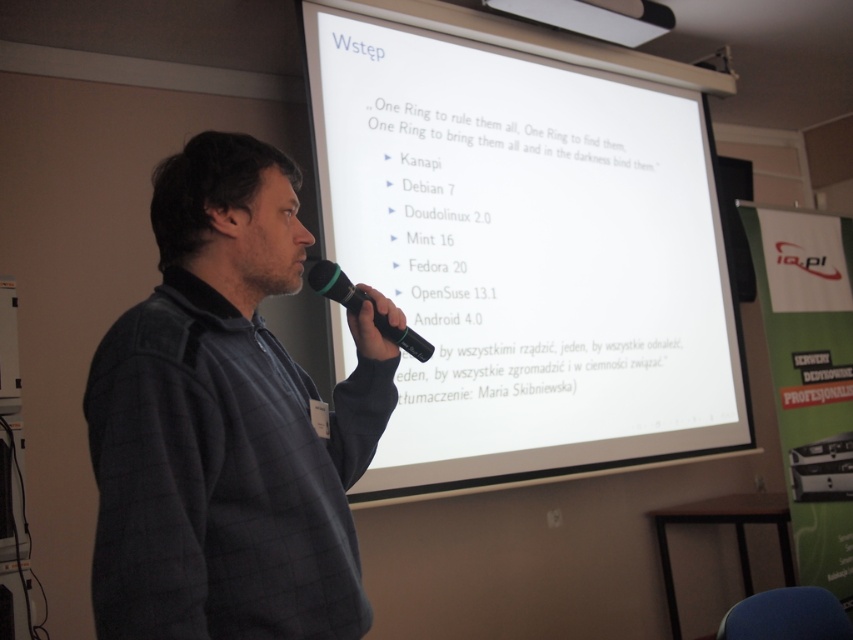
Is dark gray sweater at center above black rubber microphone at center?

No, dark gray sweater at center is not above black rubber microphone at center.

Is dark gray sweater at center in front of black rubber microphone at center?

That is True.

Who is more distant from viewer, (293, 515) or (316, 282)?

Positioned behind is point (316, 282).

Locate an element on the screen. The image size is (853, 640). dark gray sweater at center is located at coordinates (227, 422).

Is white matte projection screen at upper center positioned at the back of black rubber microphone at center?

Yes, white matte projection screen at upper center is behind black rubber microphone at center.

Can you confirm if white matte projection screen at upper center is thinner than black rubber microphone at center?

No, white matte projection screen at upper center is not thinner than black rubber microphone at center.

Does point (416, 93) come in front of point (311, 275)?

That is False.

At what (x,y) coordinates should I click in order to perform the action: click on white matte projection screen at upper center. Please return your answer as a coordinate pair (x, y). Looking at the image, I should click on (524, 252).

Does point (460, 490) come farther from viewer compared to point (221, 198)?

That is True.

Is white matte projection screen at upper center to the left of dark gray sweater at center from the viewer's perspective?

In fact, white matte projection screen at upper center is to the right of dark gray sweater at center.

Is point (618, 284) farther from viewer compared to point (250, 442)?

That is True.

This screenshot has height=640, width=853. What are the coordinates of `white matte projection screen at upper center` in the screenshot? It's located at (524, 252).